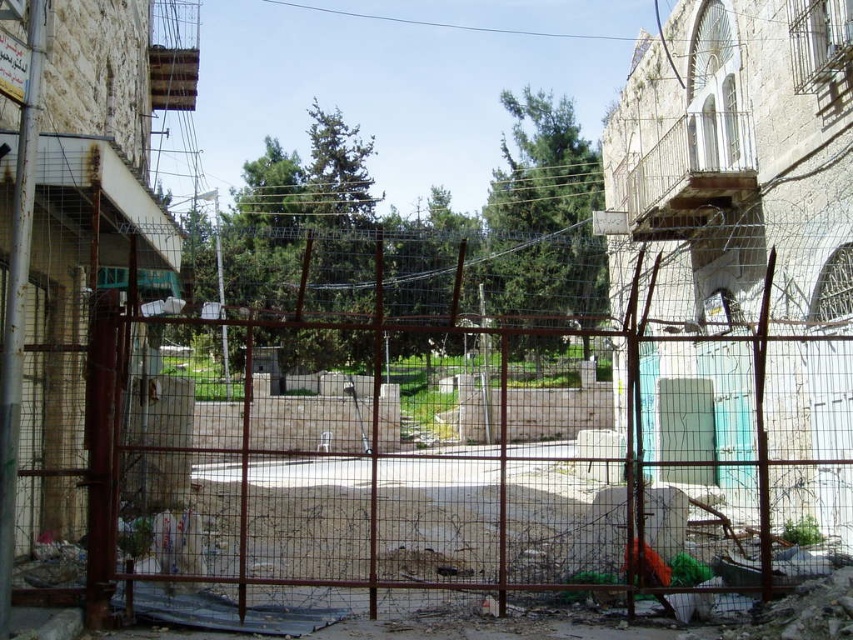
Find the location of a particular element. rusty metal fence at center is located at coordinates (437, 460).

Measure the distance between point [651,516] and camera.

37.41 feet

Identify the location of rusty metal fence at center. (437, 460).